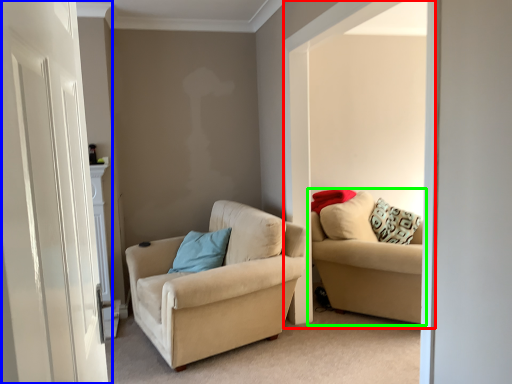
Question: Which object is the farthest from window (highlighted by a red box)? Choose among these: door (highlighted by a blue box) or studio couch (highlighted by a green box).

Choices:
 (A) door
 (B) studio couch

Answer: (A)